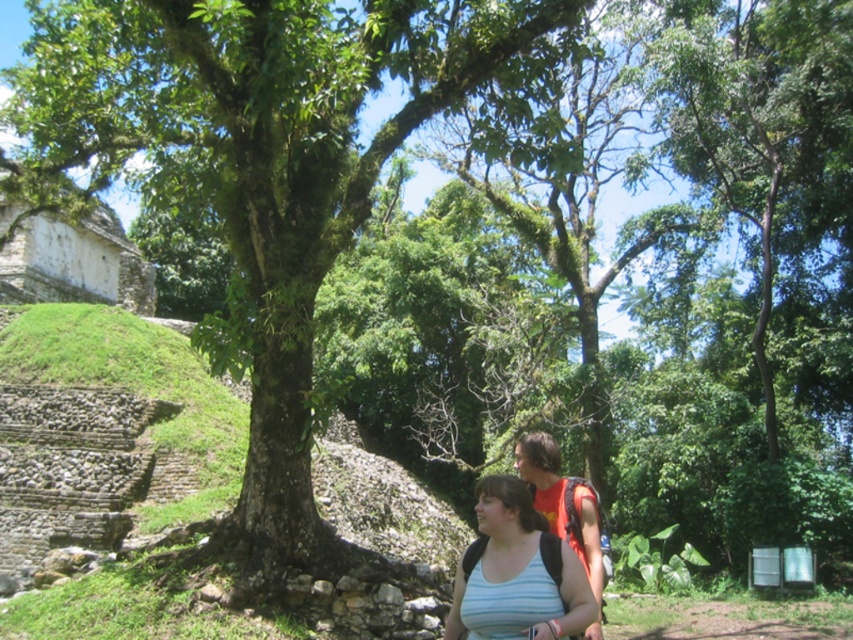
Question: Is the position of green leafy tree at center more distant than that of white stone amphitheater at upper left?

Choices:
 (A) no
 (B) yes

Answer: (A)

Question: Is green leafy tree at center in front of white stone amphitheater at upper left?

Choices:
 (A) yes
 (B) no

Answer: (A)

Question: Estimate the real-world distances between objects in this image. Which object is farther from the white stone amphitheater at upper left?

Choices:
 (A) green leafy tree at center
 (B) light blue striped tank top at center

Answer: (B)

Question: Which of the following is the farthest from the observer?

Choices:
 (A) (132, 1)
 (B) (96, 275)
 (C) (488, 529)

Answer: (B)

Question: Is green leafy tree at center to the left of light blue striped tank top at center from the viewer's perspective?

Choices:
 (A) no
 (B) yes

Answer: (B)

Question: Among these objects, which one is nearest to the camera?

Choices:
 (A) green leafy tree at center
 (B) white stone amphitheater at upper left
 (C) light blue striped tank top at center

Answer: (C)